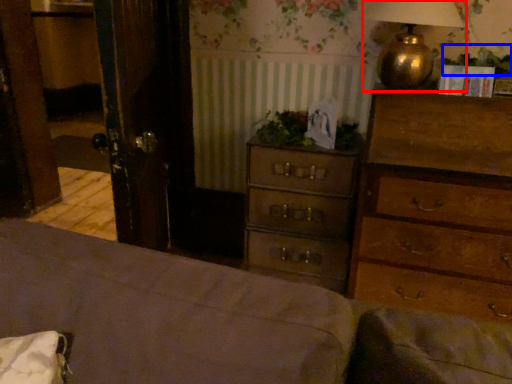
Question: Which of the following is the closest to the observer, table lamp (highlighted by a red box) or plant (highlighted by a blue box)?

Choices:
 (A) table lamp
 (B) plant

Answer: (A)